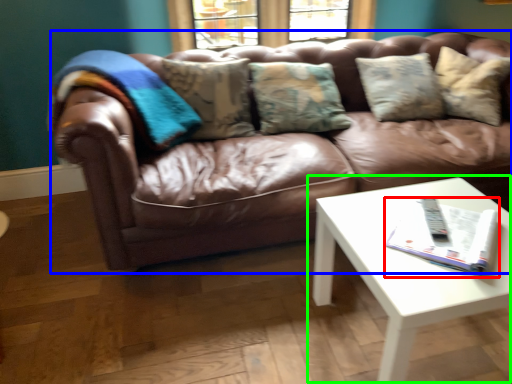
Question: Considering the real-world distances, which object is closest to magazine (highlighted by a red box)? studio couch (highlighted by a blue box) or coffee table (highlighted by a green box).

Choices:
 (A) studio couch
 (B) coffee table

Answer: (B)